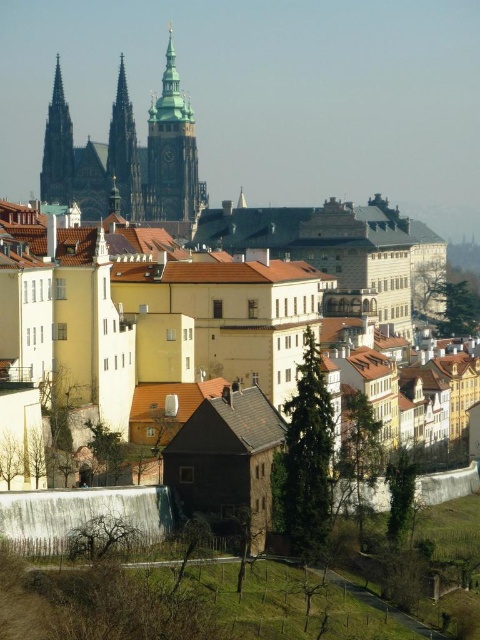
Is golden stone spire at center below smooth stone spire at upper left?

Yes.

Between point (108, 188) and point (71, 134), which one is positioned in front?

Point (108, 188) is in front.

Is point (126, 193) in front of point (47, 202)?

Yes, it is.

This screenshot has height=640, width=480. In order to click on golden stone spire at center in this screenshot , I will do `click(122, 154)`.

Looking at this image, does golden stone tower at center have a lesser width compared to smooth stone spire at upper left?

Incorrect, golden stone tower at center's width is not less than smooth stone spire at upper left's.

Is point (154, 218) positioned after point (48, 134)?

No, it is not.

Does point (192, 160) come farther from viewer compared to point (60, 196)?

Yes.

At what (x,y) coordinates should I click in order to perform the action: click on golden stone tower at center. Please return your answer as a coordinate pair (x, y). The width and height of the screenshot is (480, 640). Looking at the image, I should click on (171, 152).

Which is more to the right, golden stone tower at center or golden stone spire at center?

From the viewer's perspective, golden stone tower at center appears more on the right side.

Does golden stone tower at center have a smaller size compared to golden stone spire at center?

Yes.

Is point (179, 125) positioned after point (115, 202)?

Yes, it is.

In order to click on golden stone tower at center in this screenshot , I will do `click(171, 152)`.